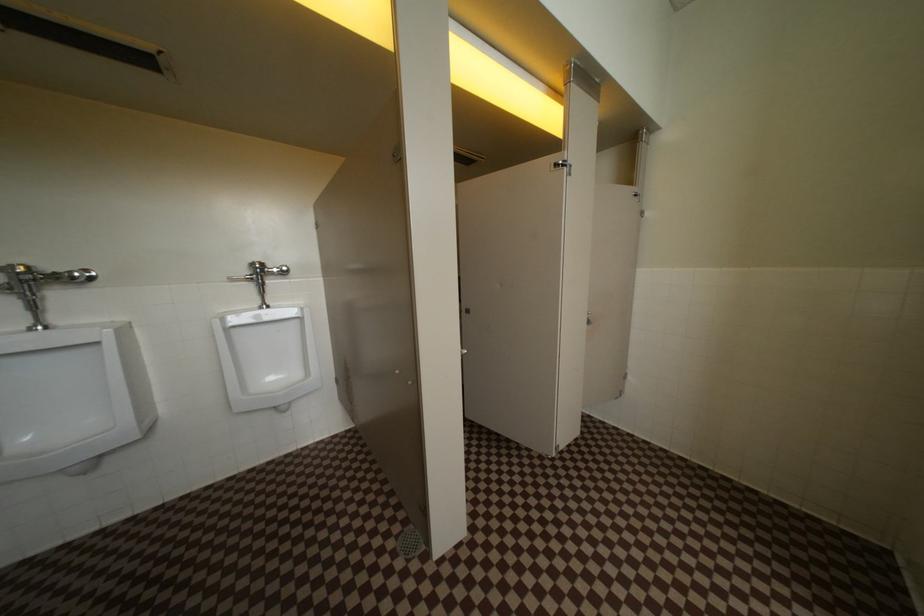
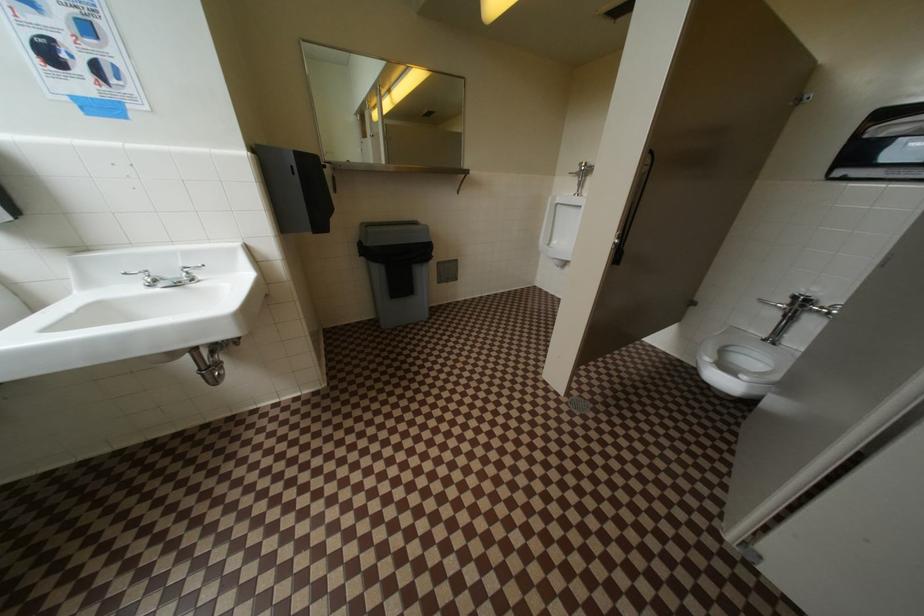
First-person continuous shooting, in which direction is the camera rotating?

The camera rotated toward left-down.